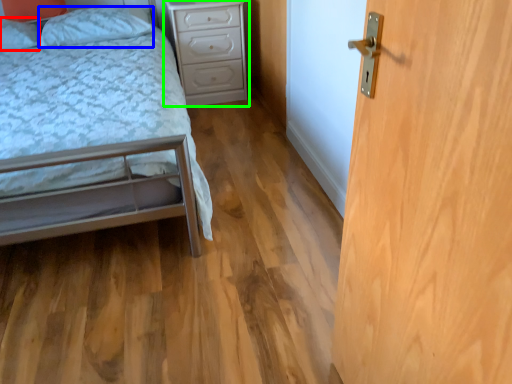
Question: Which object is the farthest from pillow (highlighted by a red box)? Choose among these: pillow (highlighted by a blue box) or nightstand (highlighted by a green box).

Choices:
 (A) pillow
 (B) nightstand

Answer: (B)